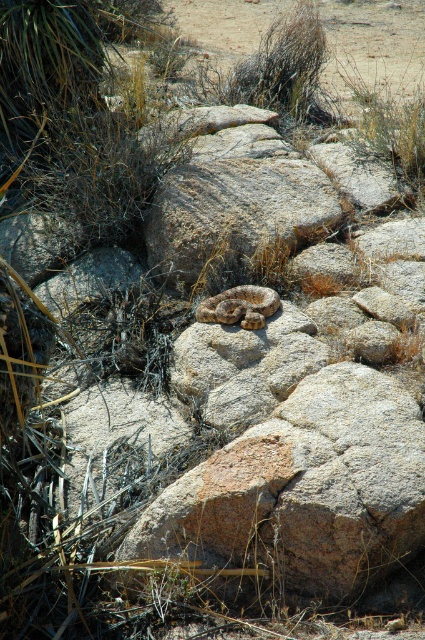
Question: Among these points, which one is farthest from the camera?

Choices:
 (A) (221, 163)
 (B) (201, 312)

Answer: (A)

Question: Which of the following is the closest to the observer?

Choices:
 (A) brown scaly snake at center
 (B) rusty stone boulder at center

Answer: (A)

Question: Which object appears closest to the camera in this image?

Choices:
 (A) brown scaly snake at center
 (B) rusty stone boulder at center

Answer: (A)

Question: From the image, what is the correct spatial relationship of rusty stone boulder at center in relation to brown scaly snake at center?

Choices:
 (A) left
 (B) right

Answer: (A)

Question: Considering the relative positions of rusty stone boulder at center and brown scaly snake at center in the image provided, where is rusty stone boulder at center located with respect to brown scaly snake at center?

Choices:
 (A) right
 (B) left

Answer: (B)

Question: Can you confirm if rusty stone boulder at center is positioned to the left of brown scaly snake at center?

Choices:
 (A) no
 (B) yes

Answer: (B)